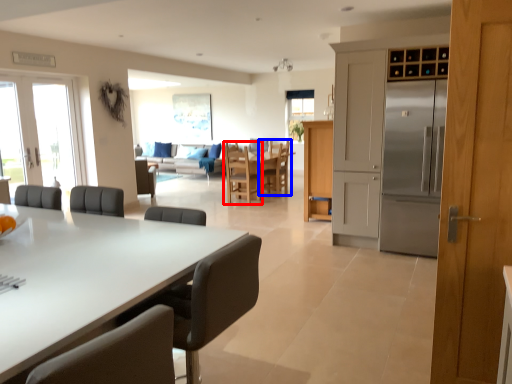
Question: Among these objects, which one is farthest to the camera, chair (highlighted by a red box) or chair (highlighted by a blue box)?

Choices:
 (A) chair
 (B) chair

Answer: (B)